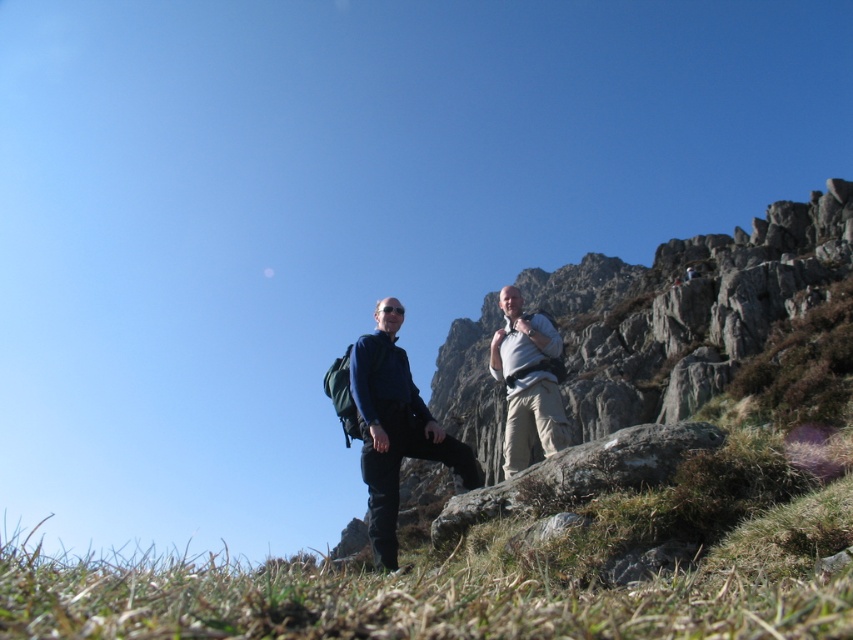
Question: Which object is positioned farthest from the dark blue fabric pants at center?

Choices:
 (A) light brown canvas backpack at center
 (B) rugged stone mountain at right
 (C) green grassy at lower center

Answer: (B)

Question: Estimate the real-world distances between objects in this image. Which object is closer to the rugged stone mountain at right?

Choices:
 (A) dark blue fabric pants at center
 (B) light brown canvas backpack at center

Answer: (B)

Question: Can you confirm if green grassy at lower center is positioned above dark blue fabric pants at center?

Choices:
 (A) no
 (B) yes

Answer: (A)

Question: Does rugged stone mountain at right have a greater width compared to dark blue fabric pants at center?

Choices:
 (A) yes
 (B) no

Answer: (A)

Question: Among these points, which one is nearest to the camera?

Choices:
 (A) (544, 445)
 (B) (625, 364)
 (C) (717, 589)
 (D) (376, 538)

Answer: (C)

Question: Is green grassy at lower center below light brown canvas backpack at center?

Choices:
 (A) no
 (B) yes

Answer: (B)